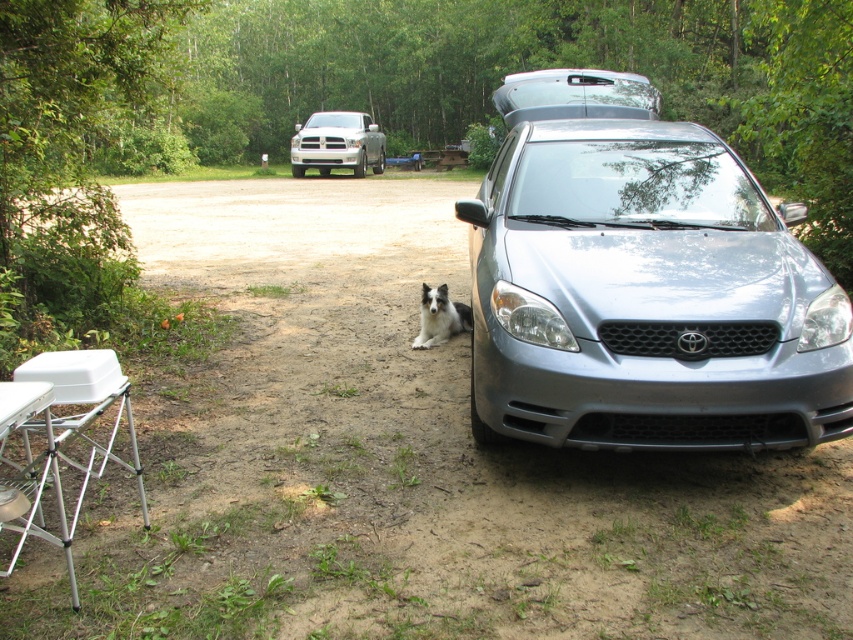
Is the position of satin silver minivan at upper center more distant than that of silver metallic truck at upper center?

That is False.

Is satin silver minivan at upper center thinner than silver metallic truck at upper center?

Incorrect, satin silver minivan at upper center's width is not less than silver metallic truck at upper center's.

Where is `satin silver minivan at upper center`? The width and height of the screenshot is (853, 640). satin silver minivan at upper center is located at coordinates (575, 96).

Is satin silver car at center positioned at the back of silver metallic truck at upper center?

No, it is not.

Who is more forward, (753, 305) or (384, 154)?

Point (753, 305) is in front.

Identify the location of satin silver car at center. The width and height of the screenshot is (853, 640). (642, 284).

Does point (247, 416) come in front of point (428, 296)?

Yes, it is.

Which is more to the left, dirt ground at center or black and white fur dog at center?

Positioned to the left is dirt ground at center.

Who is more forward, (x=33, y=548) or (x=457, y=305)?

Point (x=33, y=548) is in front.

Identify the location of dirt ground at center. This screenshot has width=853, height=640. (402, 464).